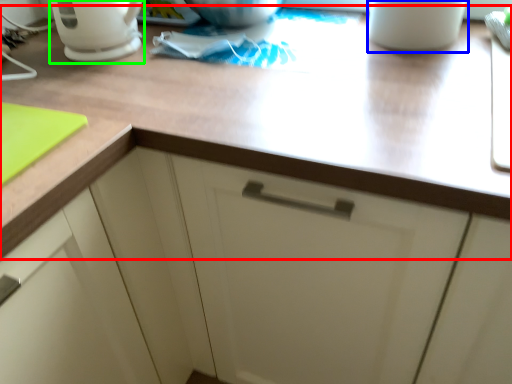
Question: Based on their relative distances, which object is nearer to countertop (highlighted by a red box)? Choose from mug (highlighted by a blue box) and coffeepot (highlighted by a green box).

Choices:
 (A) mug
 (B) coffeepot

Answer: (A)